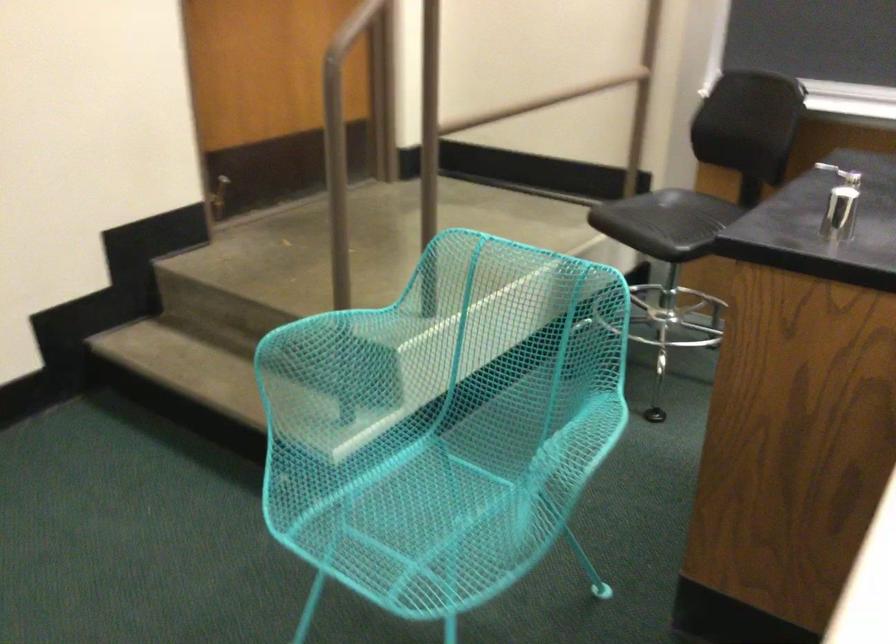
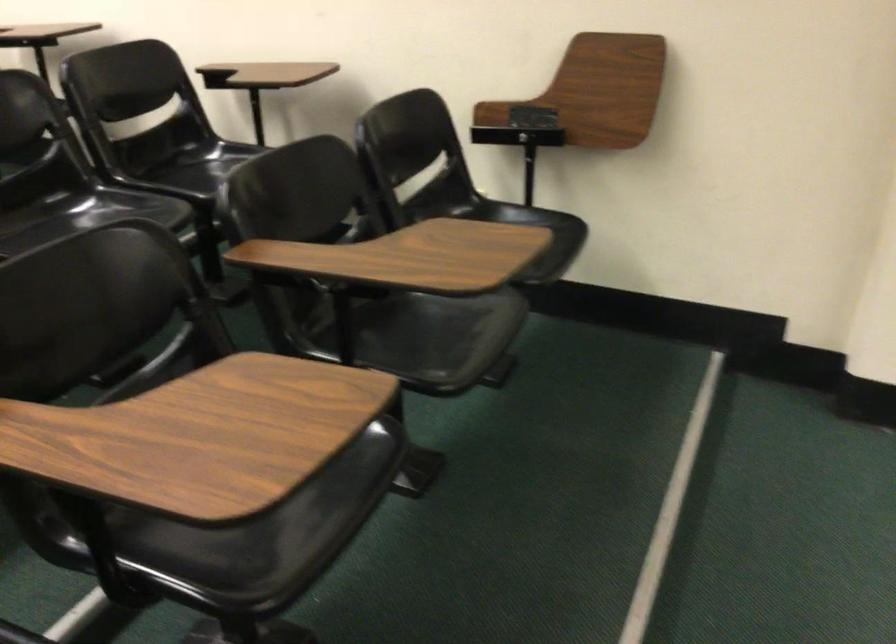
How did the camera likely rotate?

The camera's rotation is toward left-down.